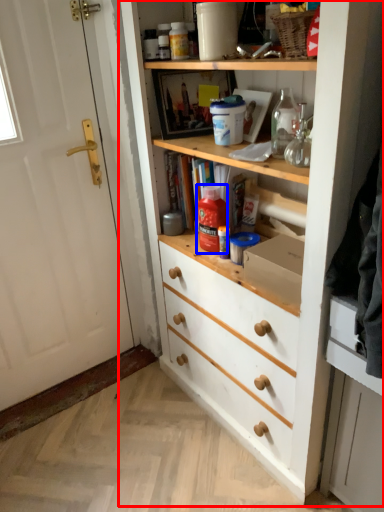
Question: Among these objects, which one is farthest to the camera, cupboard (highlighted by a red box) or bottle (highlighted by a blue box)?

Choices:
 (A) cupboard
 (B) bottle

Answer: (B)